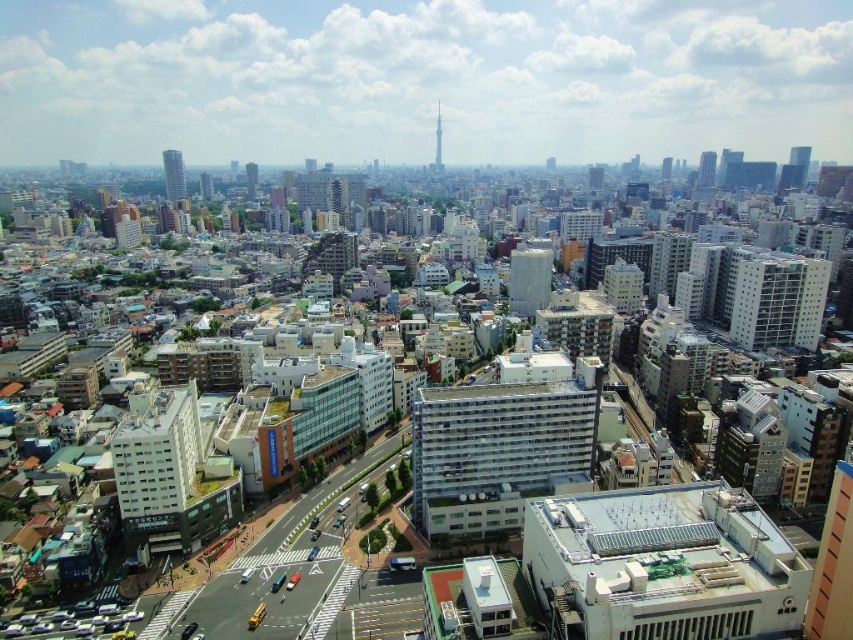
Question: Does white concrete building at center-right appear on the right side of matte glass skyscraper at upper left?

Choices:
 (A) yes
 (B) no

Answer: (A)

Question: Which of these objects is positioned closest to the matte white building at center?

Choices:
 (A) smooth glass skyscraper at upper right
 (B) white glass tower at center
 (C) matte glass skyscraper at upper right
 (D) white concrete building at center-right

Answer: (B)

Question: Which of the following is the closest to the observer?

Choices:
 (A) white concrete building at center-right
 (B) glassy steel skyscraper at upper center
 (C) white concrete building at center
 (D) matte glass skyscraper at upper left

Answer: (A)

Question: Among these points, which one is nearest to the camera?

Choices:
 (A) (808, 148)
 (B) (698, 172)
 (C) (173, 195)
 (D) (671, 157)

Answer: (A)

Question: Is matte glass skyscraper at upper left positioned behind glassy steel skyscraper at upper center?

Choices:
 (A) no
 (B) yes

Answer: (A)

Question: Does matte glass skyscraper at upper left have a smaller size compared to smooth glass skyscraper at upper right?

Choices:
 (A) no
 (B) yes

Answer: (B)